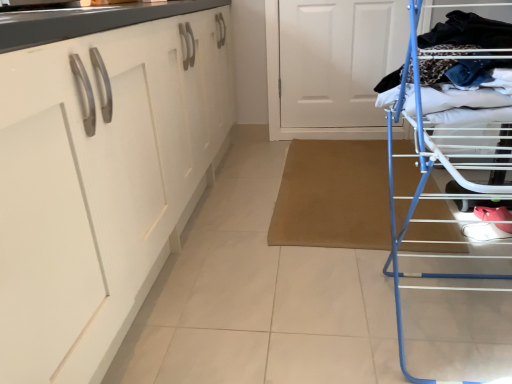
Question: Is white glossy cabinet at left taller than white matte door at upper center?

Choices:
 (A) yes
 (B) no

Answer: (A)

Question: Does white glossy cabinet at left have a smaller size compared to white matte door at upper center?

Choices:
 (A) yes
 (B) no

Answer: (B)

Question: Considering the relative sizes of white glossy cabinet at left and white matte door at upper center in the image provided, is white glossy cabinet at left bigger than white matte door at upper center?

Choices:
 (A) no
 (B) yes

Answer: (B)

Question: Can white matte door at upper center be found inside white glossy cabinet at left?

Choices:
 (A) no
 (B) yes

Answer: (A)

Question: Is white glossy cabinet at left thinner than white matte door at upper center?

Choices:
 (A) yes
 (B) no

Answer: (B)

Question: Is white glossy cabinet at left taller or shorter than white matte door at upper center?

Choices:
 (A) short
 (B) tall

Answer: (B)

Question: Considering the positions of white glossy cabinet at left and white matte door at upper center in the image, is white glossy cabinet at left bigger or smaller than white matte door at upper center?

Choices:
 (A) small
 (B) big

Answer: (B)

Question: Considering the positions of point (100, 112) and point (325, 0), is point (100, 112) closer or farther from the camera than point (325, 0)?

Choices:
 (A) closer
 (B) farther

Answer: (A)

Question: In terms of width, does white glossy cabinet at left look wider or thinner when compared to white matte door at upper center?

Choices:
 (A) thin
 (B) wide

Answer: (B)

Question: Is point (458, 56) positioned closer to the camera than point (332, 99)?

Choices:
 (A) closer
 (B) farther

Answer: (A)

Question: Is blue metal drying rack at right inside the boundaries of white matte door at upper center, or outside?

Choices:
 (A) inside
 (B) outside

Answer: (B)

Question: From a real-world perspective, is blue metal drying rack at right above or below white matte door at upper center?

Choices:
 (A) above
 (B) below

Answer: (A)

Question: From the image's perspective, is blue metal drying rack at right above or below white matte door at upper center?

Choices:
 (A) below
 (B) above

Answer: (A)

Question: Considering the positions of point (358, 117) and point (48, 236), is point (358, 117) closer or farther from the camera than point (48, 236)?

Choices:
 (A) closer
 (B) farther

Answer: (B)

Question: Is white matte door at upper center to the left or to the right of white glossy cabinet at left in the image?

Choices:
 (A) left
 (B) right

Answer: (B)